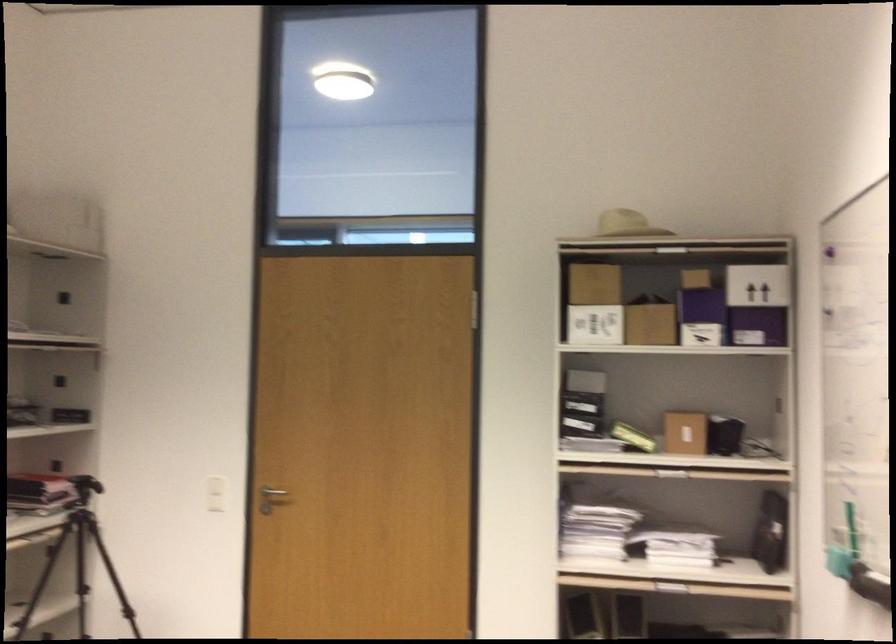
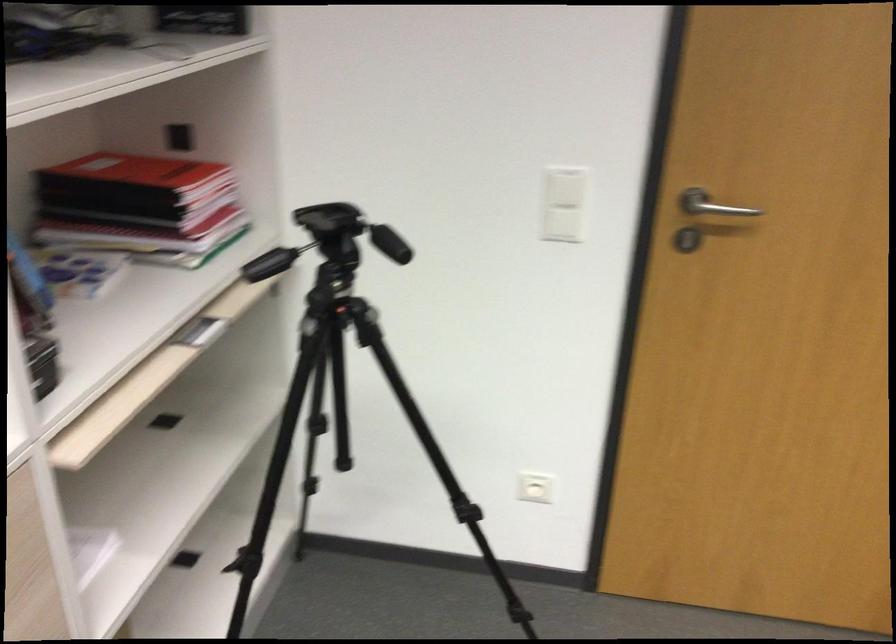
Where in the second image is the point corresponding to pixel 277 488 from the first image?

(711, 205)